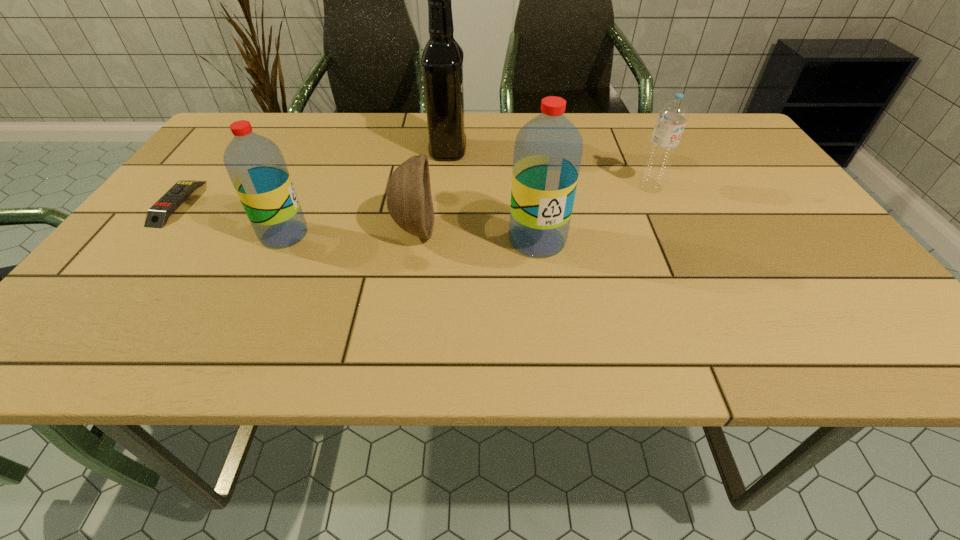
Locate an element on the screen. Image resolution: width=960 pixels, height=540 pixels. free point located on the front label of the leftmost water bottle is located at coordinates (378, 234).

This screenshot has height=540, width=960. Identify the location of free space located 0.050m on the right of the rightmost water bottle. (684, 187).

In order to click on free space located on the right of the leftmost object in this screenshot , I will do `click(303, 203)`.

The image size is (960, 540). I want to click on vacant space located 0.060m on the front-facing side of the farthest object, so click(x=489, y=150).

You are a GUI agent. You are given a task and a screenshot of the screen. Output one action in this format:
    pyautogui.click(x=<x>, y=<y>)
    Task: Click on the vacant space situated 0.390m on the back of the bowl
    The image size is (960, 540).
    Given the screenshot: What is the action you would take?
    pyautogui.click(x=431, y=125)

You are a GUI agent. You are given a task and a screenshot of the screen. Output one action in this format:
    pyautogui.click(x=<x>, y=<y>)
    Task: Click on the object located at the far edge
    This screenshot has height=540, width=960.
    Given the screenshot: What is the action you would take?
    pyautogui.click(x=442, y=60)

Identify the location of object situated at the left edge. (157, 216).

Image resolution: width=960 pixels, height=540 pixels. Identify the location of free location at the far edge of the desktop. (602, 153).

In the image, there is a desktop. Identify the location of vacant area at the near edge. The width and height of the screenshot is (960, 540). (592, 287).

In order to click on vacant space at the left edge of the desktop in this screenshot , I will do `click(153, 239)`.